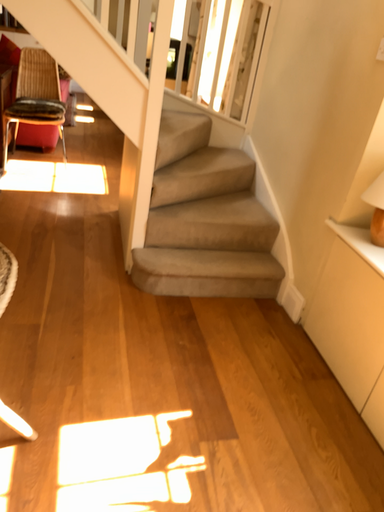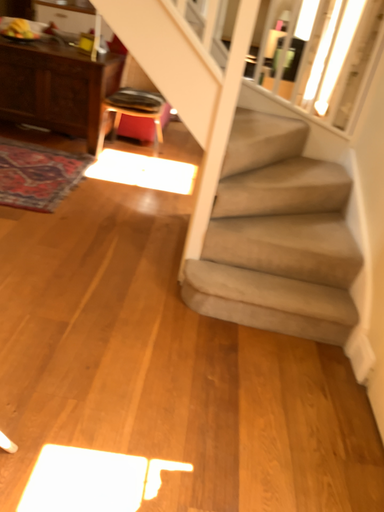
Question: Which way did the camera rotate in the video?

Choices:
 (A) rotated left
 (B) rotated right

Answer: (A)